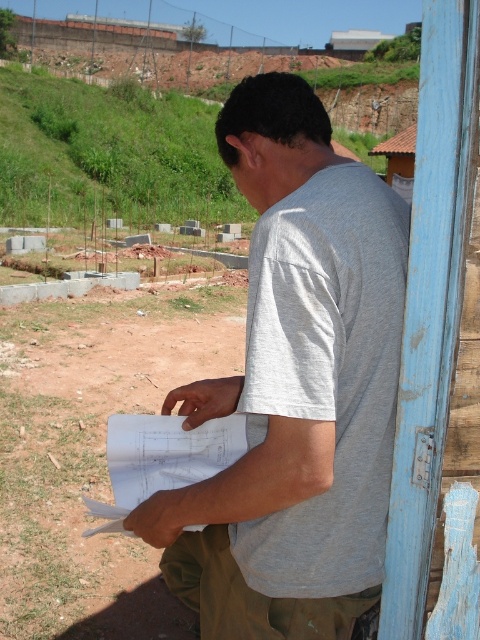
Question: Is brown dirt field at lower left bigger than khaki fabric at lower center?

Choices:
 (A) yes
 (B) no

Answer: (B)

Question: Based on their relative distances, which object is farther from the brown dirt field at lower left?

Choices:
 (A) khaki fabric at lower center
 (B) gray matte shirt at center

Answer: (A)

Question: Which object appears closest to the camera in this image?

Choices:
 (A) brown dirt field at lower left
 (B) gray matte shirt at center

Answer: (B)

Question: Which point is farther to the camera?

Choices:
 (A) (283, 518)
 (B) (9, 396)
 (C) (288, 611)

Answer: (B)

Question: Can you confirm if brown dirt field at lower left is positioned above khaki fabric at lower center?

Choices:
 (A) yes
 (B) no

Answer: (B)

Question: Can you confirm if gray matte shirt at center is positioned to the left of khaki fabric at lower center?

Choices:
 (A) no
 (B) yes

Answer: (B)